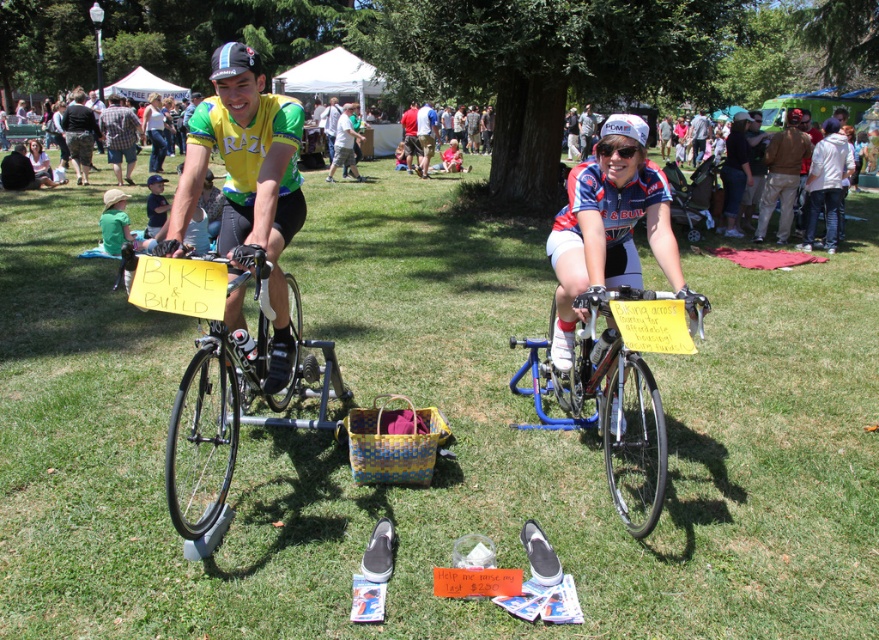
Question: Estimate the real-world distances between objects in this image. Which object is closer to the plaid shirt at center?

Choices:
 (A) white jersey at center
 (B) shiny black frame at left

Answer: (B)

Question: Is plaid shirt at center to the right of white matte bicycle helmet at center from the viewer's perspective?

Choices:
 (A) no
 (B) yes

Answer: (A)

Question: Does matte yellow-green jersey at center have a smaller size compared to blue metallic bicycle at center?

Choices:
 (A) yes
 (B) no

Answer: (A)

Question: Which point is farther to the camera?

Choices:
 (A) shiny black frame at left
 (B) blue jersey at center
 (C) plaid shirt at center
 (D) white jersey at center

Answer: (B)

Question: From the image, what is the correct spatial relationship of light blue jersey at center in relation to white matte bicycle helmet at center?

Choices:
 (A) below
 (B) above

Answer: (B)

Question: Which point is farther to the camera?

Choices:
 (A) (304, 364)
 (B) (638, 132)
 (C) (354, 129)
 (D) (607, 260)

Answer: (C)